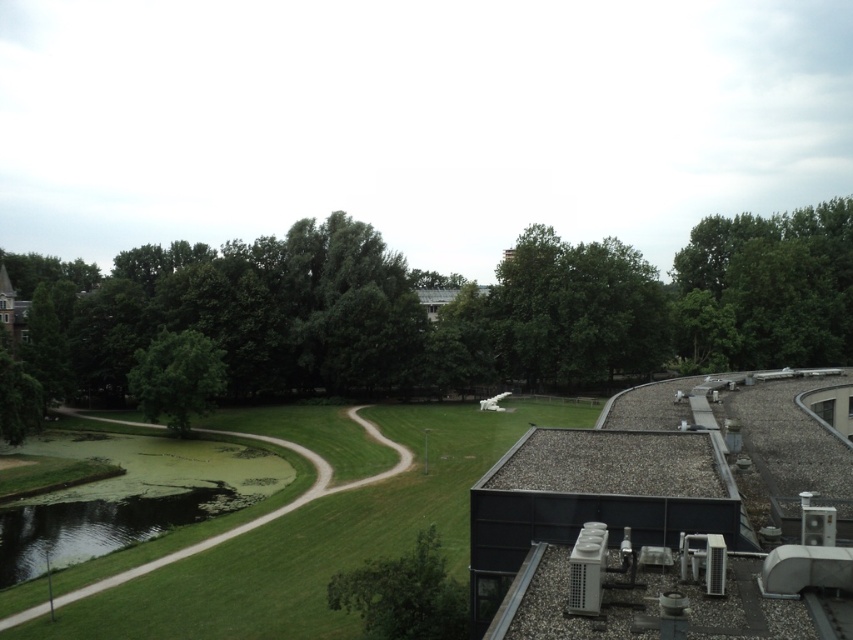
Does green leafy tree at upper right have a larger size compared to green leafy tree at center-left?

Indeed, green leafy tree at upper right has a larger size compared to green leafy tree at center-left.

Consider the image. Does green leafy tree at upper right have a greater height compared to green leafy tree at center-left?

Indeed, green leafy tree at upper right has a greater height compared to green leafy tree at center-left.

In order to click on green leafy tree at upper right in this screenshot , I will do `click(766, 289)`.

Is green mossy pond at lower left further to the viewer compared to green leafy tree at center-left?

No.

Between point (141, 529) and point (149, 355), which one is positioned in front?

Point (141, 529) is in front.

The height and width of the screenshot is (640, 853). I want to click on green mossy pond at lower left, so click(97, 525).

Is green mossy pond at lower left wider than green leafy tree at lower center?

Yes, green mossy pond at lower left is wider than green leafy tree at lower center.

Is green mossy pond at lower left taller than green leafy tree at lower center?

No, green mossy pond at lower left is not taller than green leafy tree at lower center.

Describe the element at coordinates (97, 525) in the screenshot. I see `green mossy pond at lower left` at that location.

Where is `green mossy pond at lower left`? green mossy pond at lower left is located at coordinates (97, 525).